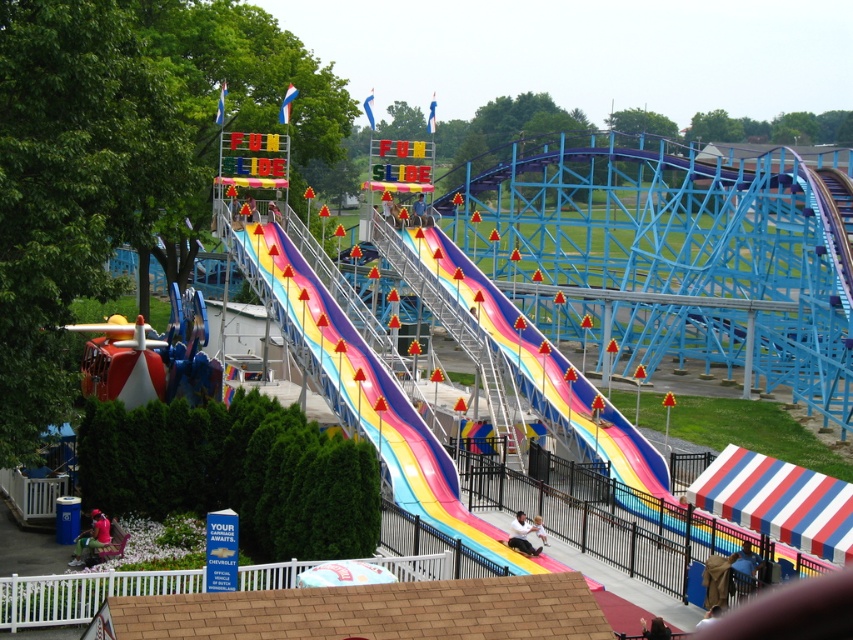
You are a visitor at the amusement park and want to take a photo of both the rainbow striped slide at center and the blue fabric umbrella at lower right. Which object should you focus on first if you want to capture both in the same frame without moving your camera?

The rainbow striped slide at center is taller than the blue fabric umbrella at lower right, so you should focus on the rainbow striped slide at center first to ensure it fits in the frame, then adjust to include the smaller blue fabric umbrella at lower right.

You are a parent trying to decide whether to let your child use the rainbow plastic slide at center. The child is wearing a smooth white shirt at center. Considering the size of the slide and the shirt, will the shirt be able to fit comfortably on the slide?

The rainbow plastic slide at center has a larger size compared to smooth white shirt at center, so the smooth white shirt at center will fit comfortably on the rainbow plastic slide at center.